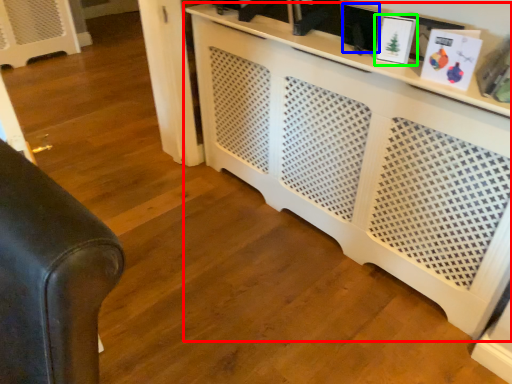
Question: Which object is positioned closest to entertainment center (highlighted by a red box)? Select from picture frame (highlighted by a blue box) and picture frame (highlighted by a green box).

Choices:
 (A) picture frame
 (B) picture frame

Answer: (A)